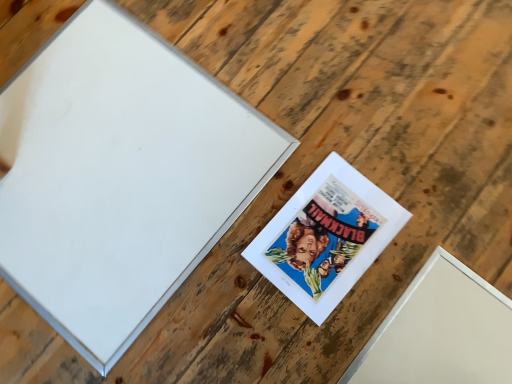
Question: From their relative heights in the image, would you say matte paper picture frame at center, arranged as the first picture frame when viewed from the right, is taller or shorter than white matte picture frame at upper left, which is counted as the first picture frame, starting from the left?

Choices:
 (A) short
 (B) tall

Answer: (A)

Question: Is matte paper picture frame at center, arranged as the first picture frame when viewed from the right, in front of or behind white matte picture frame at upper left, which is counted as the first picture frame, starting from the left, in the image?

Choices:
 (A) front
 (B) behind

Answer: (B)

Question: Looking at the image, does matte paper picture frame at center, placed as the 2th picture frame when sorted from left to right, seem bigger or smaller compared to white matte picture frame at upper left, placed as the 2th picture frame when sorted from right to left?

Choices:
 (A) small
 (B) big

Answer: (A)

Question: Considering the positions of point (90, 354) and point (355, 276), is point (90, 354) closer or farther from the camera than point (355, 276)?

Choices:
 (A) farther
 (B) closer

Answer: (B)

Question: Looking at the image, does white matte picture frame at upper left, which is counted as the first picture frame, starting from the left, seem bigger or smaller compared to matte paper picture frame at center, placed as the 2th picture frame when sorted from left to right?

Choices:
 (A) big
 (B) small

Answer: (A)

Question: From a real-world perspective, relative to matte paper picture frame at center, arranged as the first picture frame when viewed from the right, is white matte picture frame at upper left, placed as the 2th picture frame when sorted from right to left, vertically above or below?

Choices:
 (A) above
 (B) below

Answer: (A)

Question: Considering the positions of white matte picture frame at upper left, placed as the 2th picture frame when sorted from right to left, and matte paper picture frame at center, placed as the 2th picture frame when sorted from left to right, in the image, is white matte picture frame at upper left, placed as the 2th picture frame when sorted from right to left, wider or thinner than matte paper picture frame at center, placed as the 2th picture frame when sorted from left to right,?

Choices:
 (A) wide
 (B) thin

Answer: (A)